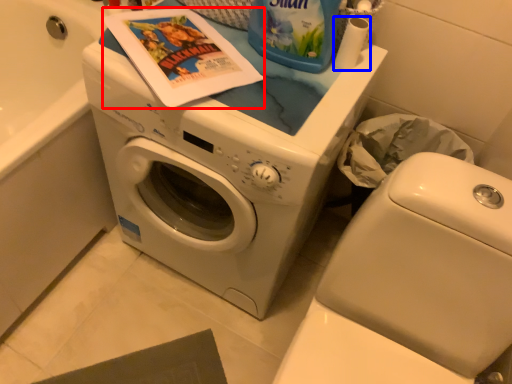
Question: Which point is closer to the camera, comic book (highlighted by a red box) or toilet paper (highlighted by a blue box)?

Choices:
 (A) comic book
 (B) toilet paper

Answer: (A)